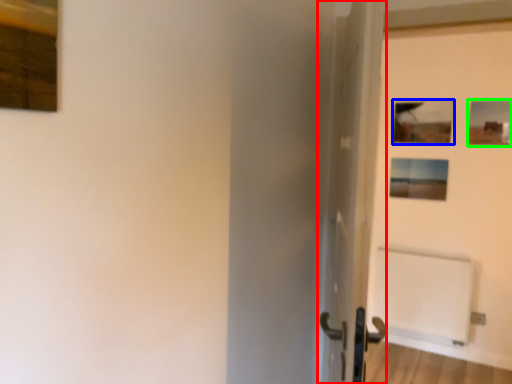
Question: Which object is the farthest from door (highlighted by a red box)? Choose among these: picture frame (highlighted by a blue box) or picture frame (highlighted by a green box).

Choices:
 (A) picture frame
 (B) picture frame

Answer: (B)